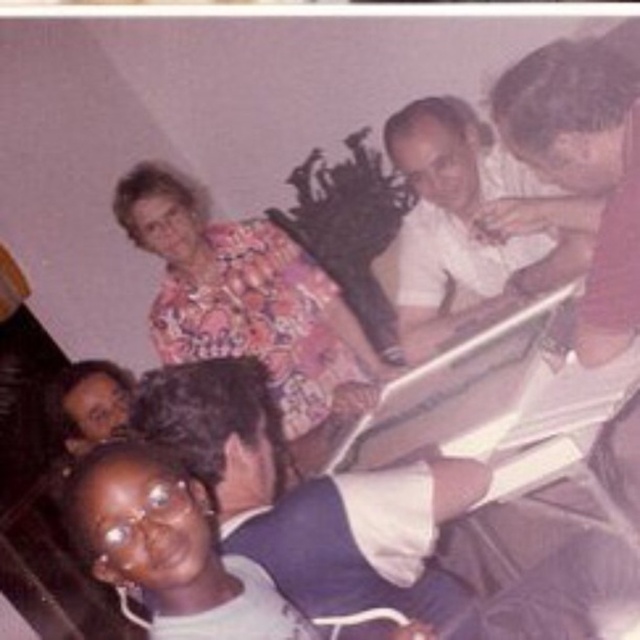
You are standing at the center of the room and want to hand a gift to the person wearing the blue fabric shirt at lower left. Based on their position, in which general direction should you move to reach them?

The blue fabric shirt at lower left is located at point 0.812 on the x and 0.553 on the y coordinates, so you should move towards the lower left direction to reach them.

Based on the photo, you are organizing a photo album and need to identify which of the two items is bigger. Looking at the image, which is larger between the floral fabric blouse at upper center and the matte white shirt at upper right?

The floral fabric blouse at upper center is larger in size than the matte white shirt at upper right.

Based on the coordinates provided in the scene description, where is the matte white shirt at upper right located?

The matte white shirt at upper right is located at point (467, 227).